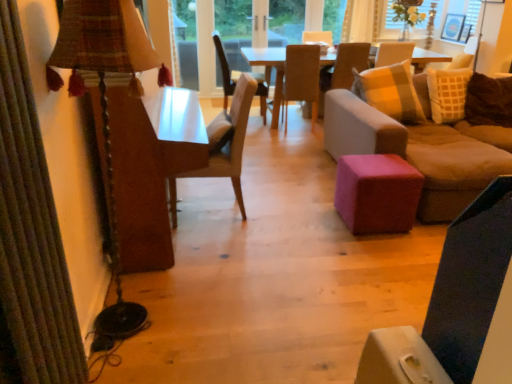
At what (x,y) coordinates should I click in order to perform the action: click on vacant space to the right of textured fabric lampshade at left. Please return your answer as a coordinate pair (x, y). This screenshot has width=512, height=384. Looking at the image, I should click on (220, 305).